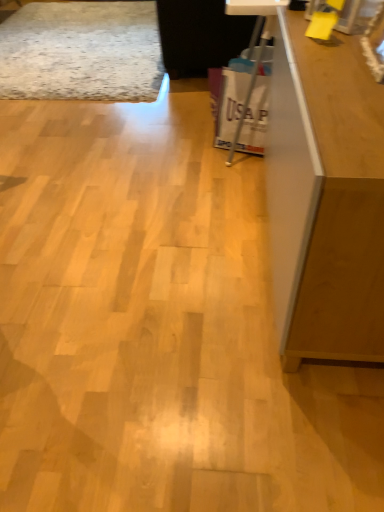
Question: From the image's perspective, is wooden counter top at upper right above or below matte brown cabinet at right?

Choices:
 (A) above
 (B) below

Answer: (A)

Question: Looking at the image, does wooden counter top at upper right seem bigger or smaller compared to matte brown cabinet at right?

Choices:
 (A) small
 (B) big

Answer: (A)

Question: Estimate the real-world distances between objects in this image. Which object is closer to the white plastic bag at center?

Choices:
 (A) matte brown cabinet at right
 (B) wooden counter top at upper right

Answer: (B)

Question: Which object is the farthest from the wooden counter top at upper right?

Choices:
 (A) white plastic bag at center
 (B) matte brown cabinet at right

Answer: (A)